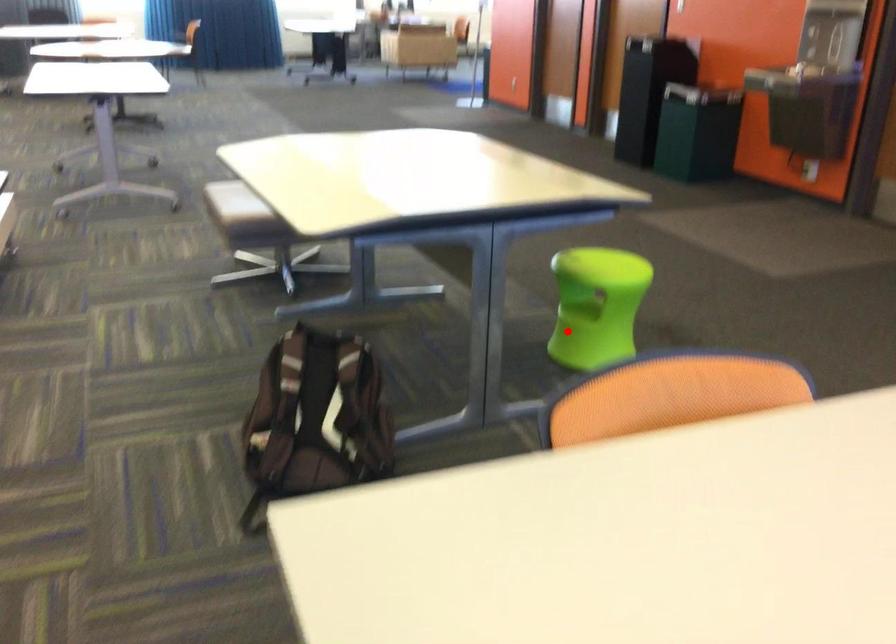
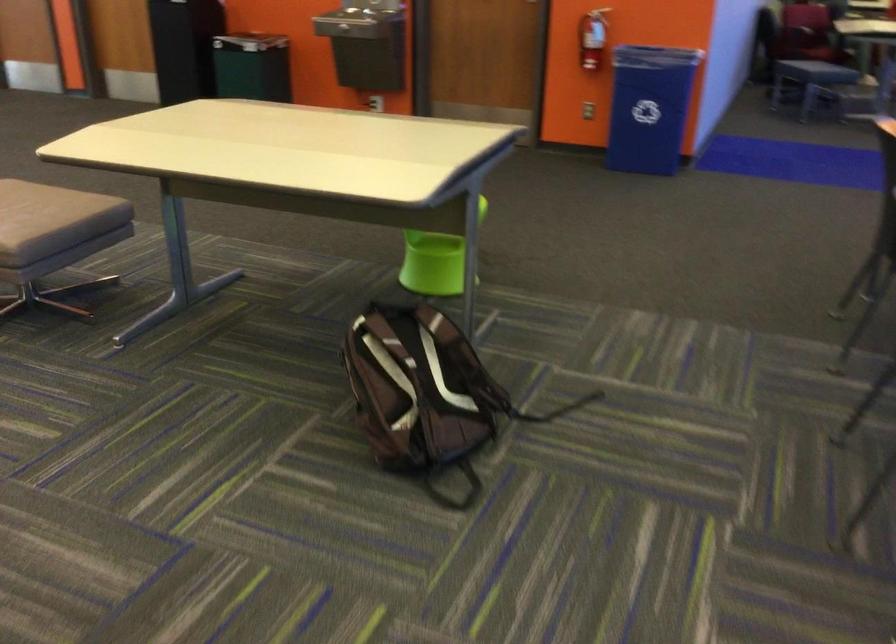
In the second image, find the point that corresponds to the highlighted location in the first image.

(435, 261)